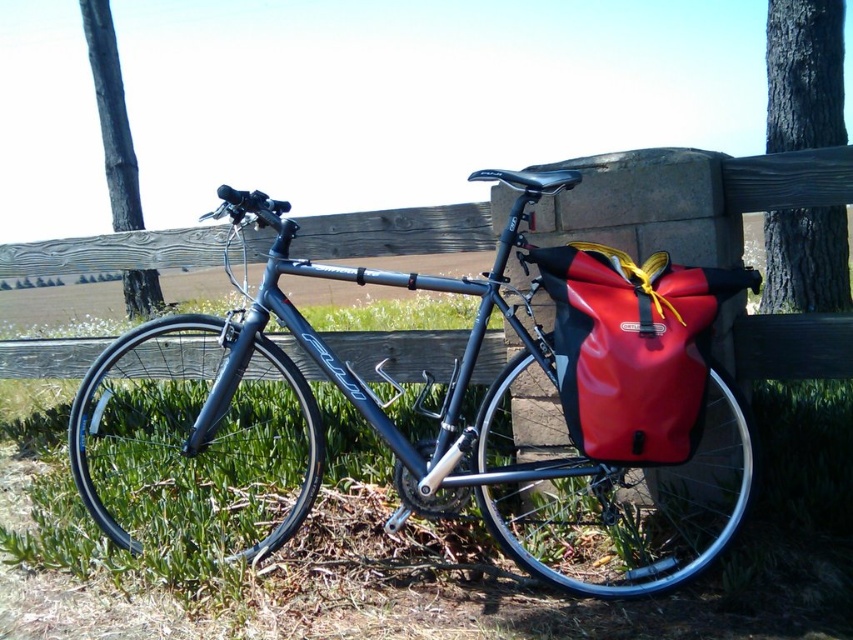
Question: Is shiny black bicycle at center thinner than wooden at center?

Choices:
 (A) yes
 (B) no

Answer: (B)

Question: Does green grass at lower left come in front of wooden at center?

Choices:
 (A) yes
 (B) no

Answer: (A)

Question: Which point is farther to the camera?

Choices:
 (A) wooden at center
 (B) red matte bag at right

Answer: (A)

Question: Considering the real-world distances, which object is farthest from the shiny black bicycle at center?

Choices:
 (A) green grass at lower left
 (B) wooden at center
 (C) yellow fabric strap at right
 (D) red matte bag at right

Answer: (C)

Question: Is the position of shiny black bicycle at center less distant than that of yellow fabric strap at right?

Choices:
 (A) no
 (B) yes

Answer: (B)

Question: Which object is positioned farthest from the green grass at lower left?

Choices:
 (A) wooden at center
 (B) red matte bag at right

Answer: (A)